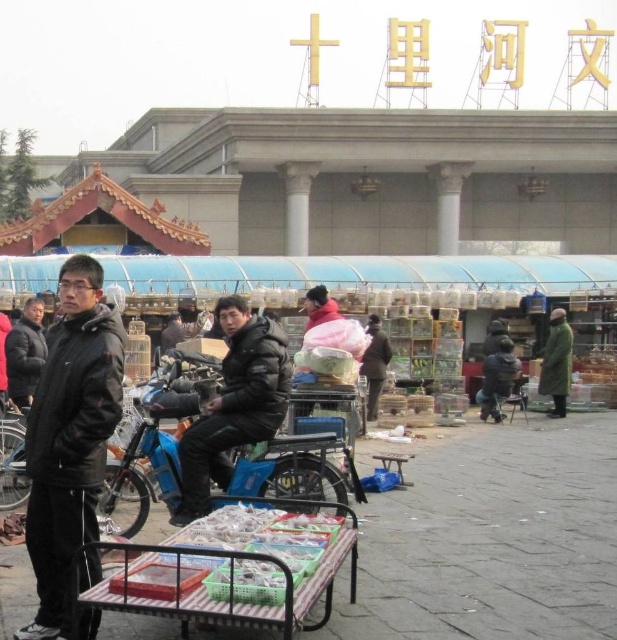
Is metallic silver cart at lower center further to the viewer compared to green matte coat at right?

No, it is not.

Measure the distance between point (312, 515) and camera.

Point (312, 515) is 25.34 meters away from camera.

Find the location of a particular element. This screenshot has height=640, width=617. metallic silver cart at lower center is located at coordinates (238, 566).

Between point (262, 420) and point (263, 548), which one is positioned behind?

Positioned behind is point (262, 420).

Between black matte jacket at center and translucent plastic tray at lower center, which one is positioned higher?

black matte jacket at center is higher up.

This screenshot has width=617, height=640. Describe the element at coordinates (234, 404) in the screenshot. I see `black matte jacket at center` at that location.

The width and height of the screenshot is (617, 640). I want to click on black matte jacket at center, so click(234, 404).

Is black matte jacket at center further to the viewer compared to green matte coat at right?

No.

Can you confirm if black matte jacket at center is positioned to the right of green matte coat at right?

No, black matte jacket at center is not to the right of green matte coat at right.

Is point (242, 330) in front of point (540, 364)?

Yes, it is.

At what (x,y) coordinates should I click in order to perform the action: click on black matte jacket at center. Please return your answer as a coordinate pair (x, y). Image resolution: width=617 pixels, height=640 pixels. Looking at the image, I should click on (234, 404).